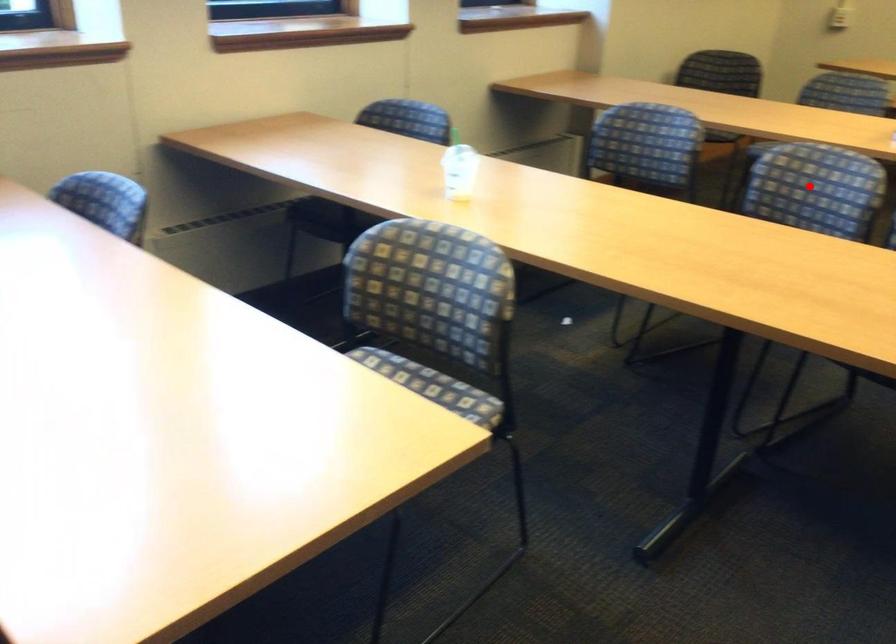
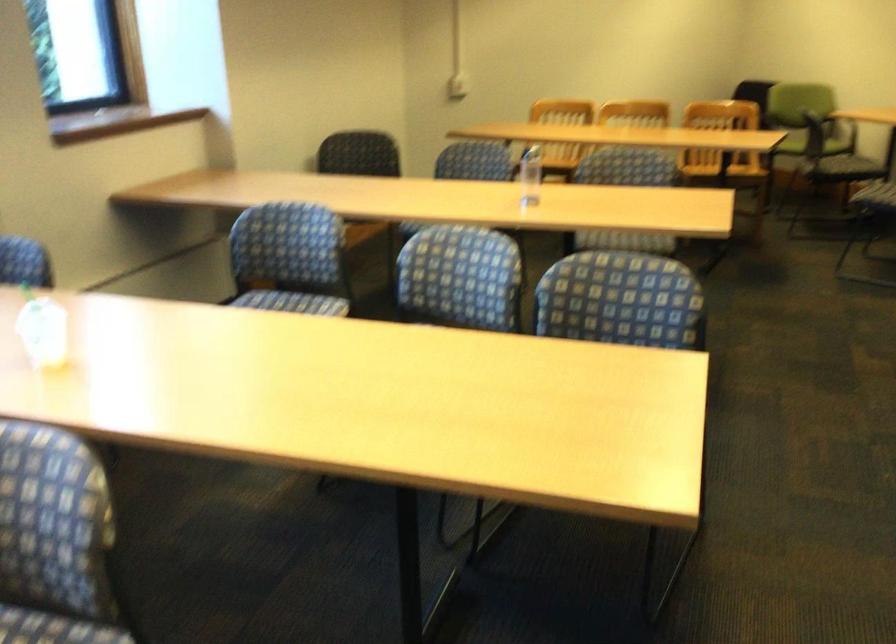
Locate, in the second image, the point that corresponds to the highlighted location in the first image.

(460, 277)